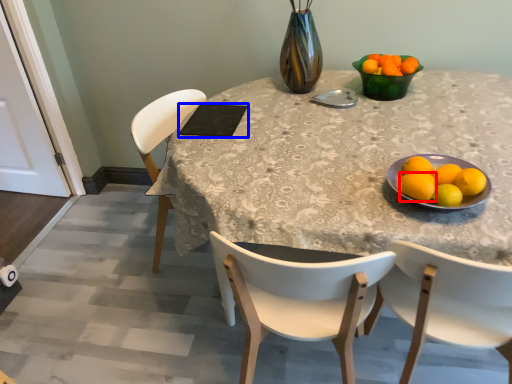
Question: Which object is closer to the camera taking this photo, lemon (highlighted by a red box) or pad (highlighted by a blue box)?

Choices:
 (A) lemon
 (B) pad

Answer: (A)